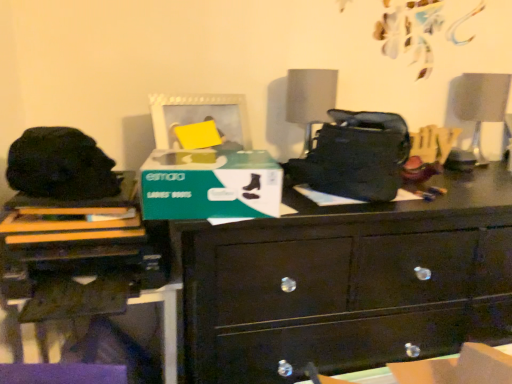
The width and height of the screenshot is (512, 384). In order to click on vacant area that lies in front of white glossy swivel chair at upper right in this screenshot , I will do `click(482, 169)`.